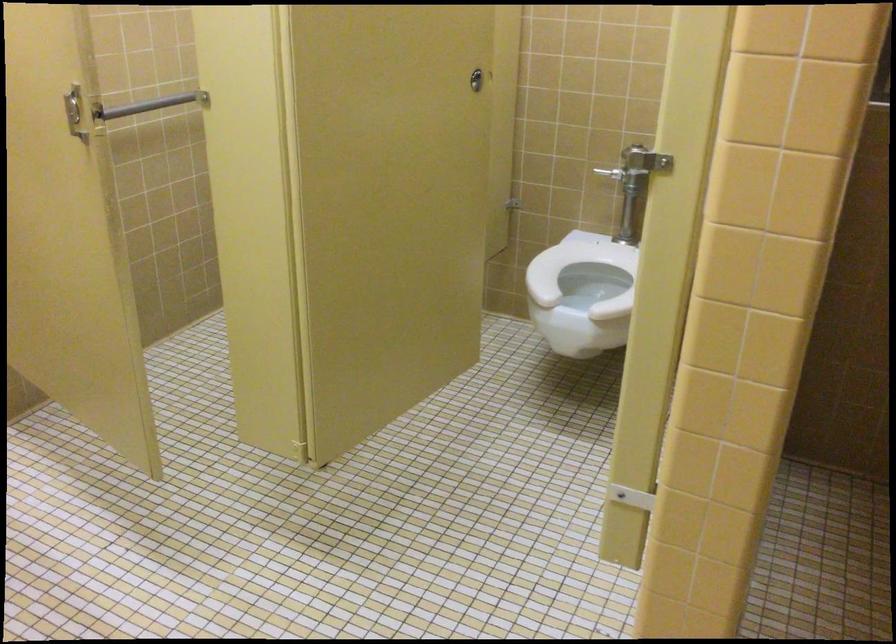
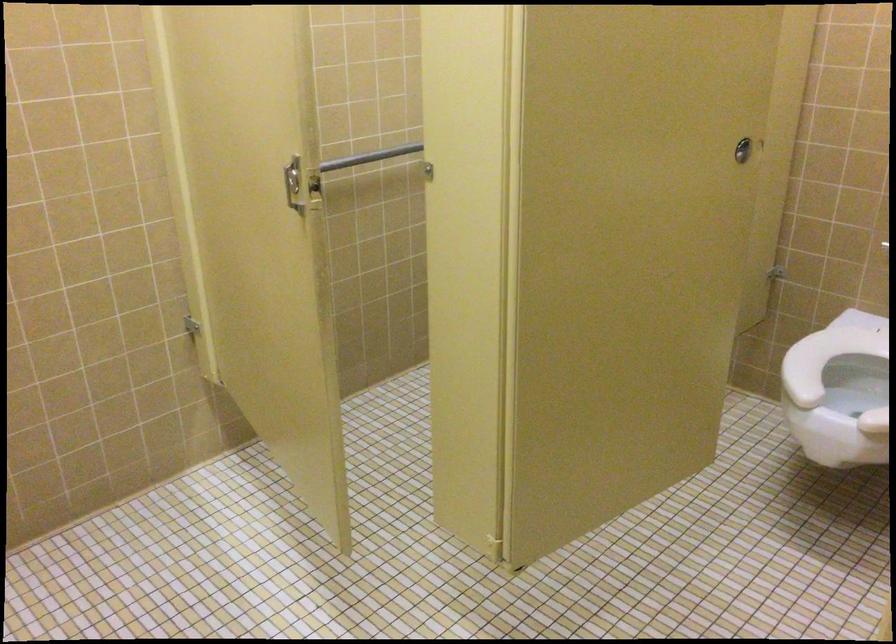
Question: In a continuous first-person perspective shot, in which direction is the camera moving?

Choices:
 (A) Left
 (B) Right
 (C) Forward
 (D) Backward

Answer: (C)